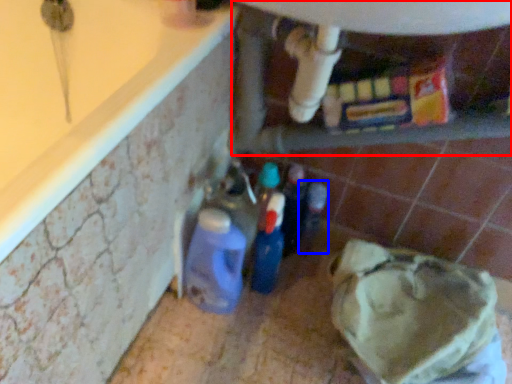
Question: Among these objects, which one is farthest to the camera, water heater (highlighted by a red box) or bottle (highlighted by a blue box)?

Choices:
 (A) water heater
 (B) bottle

Answer: (B)